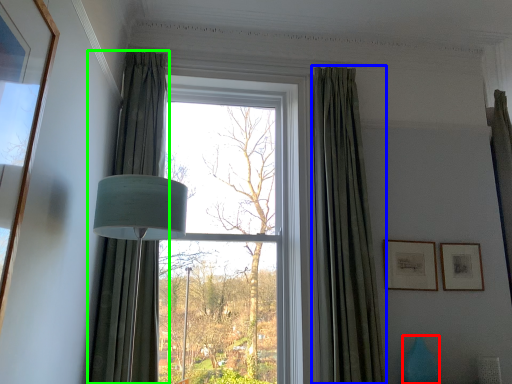
Question: Which is farther away from vase (highlighted by a red box)? curtain (highlighted by a blue box) or curtain (highlighted by a green box)?

Choices:
 (A) curtain
 (B) curtain

Answer: (B)